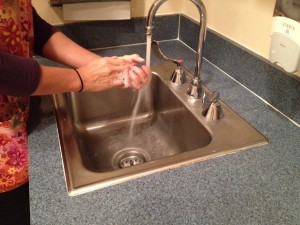
Where is `paper towel`? The width and height of the screenshot is (300, 225). paper towel is located at coordinates [97, 11].